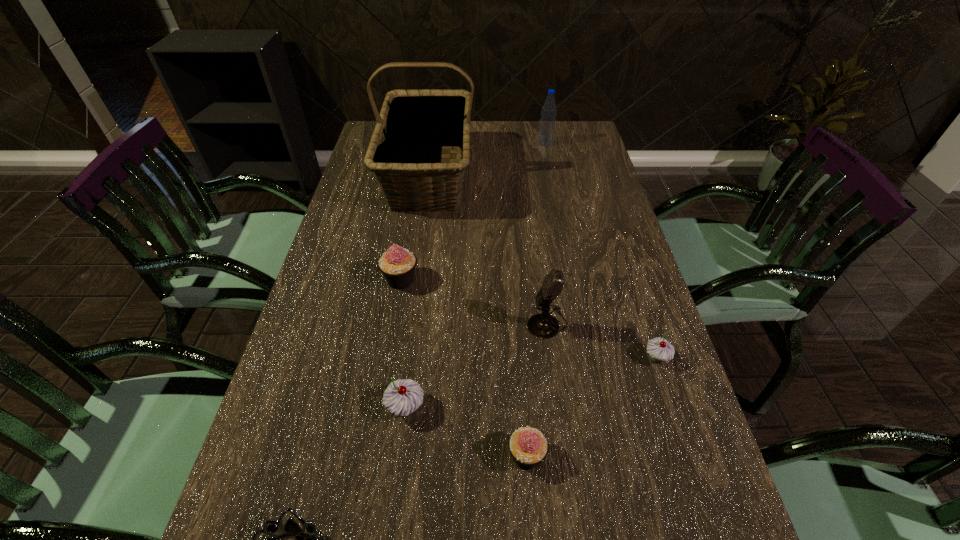
The width and height of the screenshot is (960, 540). I want to click on basket, so click(x=416, y=119).

Find the location of `blue water bottle`. blue water bottle is located at coordinates (547, 123).

Find the location of a particular element. The height and width of the screenshot is (540, 960). the seventh object from left to right is located at coordinates (547, 123).

You are a GUI agent. You are given a task and a screenshot of the screen. Output one action in this format:
    pyautogui.click(x=<x>, y=<y>)
    Task: Click on the fifth nearest object
    This screenshot has width=960, height=540.
    Given the screenshot: What is the action you would take?
    pyautogui.click(x=544, y=326)

Where is `the second nearest cupcake`? the second nearest cupcake is located at coordinates (402, 397).

Where is `the left gray cupcake`? the left gray cupcake is located at coordinates (402, 397).

Find the location of a particular element. The height and width of the screenshot is (540, 960). the left pink cupcake is located at coordinates (397, 264).

This screenshot has height=540, width=960. What are the coordinates of `the bigger pink cupcake` in the screenshot? It's located at (397, 264).

Identify the location of the smaller gray cupcake. This screenshot has height=540, width=960. (659, 349).

Image resolution: width=960 pixels, height=540 pixels. In order to click on the right gray cupcake in this screenshot , I will do `click(659, 349)`.